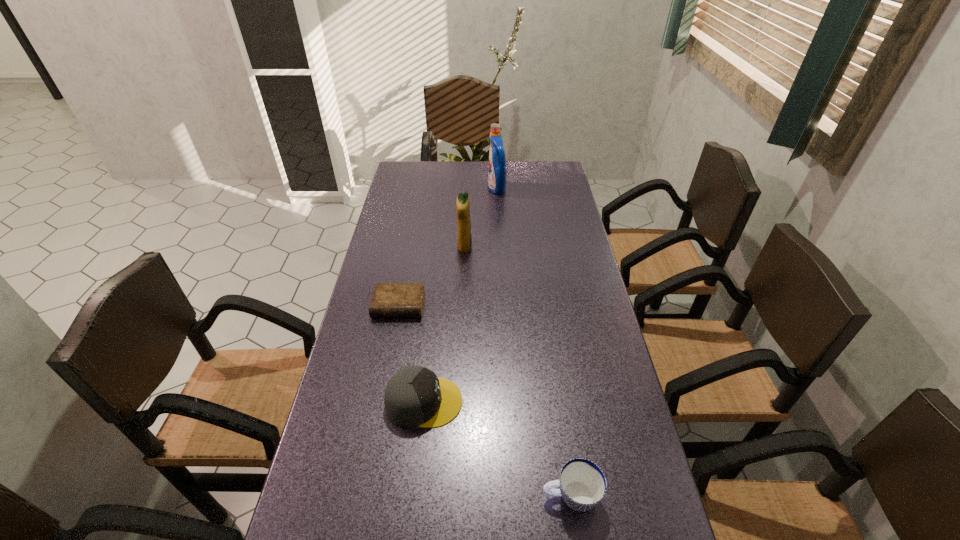
Locate an element on the screen. This screenshot has height=540, width=960. free space between the third nearest object and the left detergent is located at coordinates (432, 276).

Find the location of a particular element. This screenshot has height=540, width=960. free point between the third nearest object and the cap is located at coordinates (412, 354).

Locate an element on the screen. The image size is (960, 540). free area in between the right detergent and the shortest object is located at coordinates (447, 247).

I want to click on free space between the cap and the nearest object, so click(x=497, y=449).

Locate an element on the screen. vacant space in between the left detergent and the cap is located at coordinates (444, 325).

This screenshot has height=540, width=960. Identify the location of free space that is in between the nearer detergent and the rightmost object. (517, 372).

Identify which object is located as the third nearest to the rightmost object. Please provide its 2D coordinates. Your answer should be formatted as a tuple, i.e. [(x, y)], where the tuple contains the x and y coordinates of a point satisfying the conditions above.

[(464, 241)]

At what (x,y) coordinates should I click in order to perform the action: click on object that is the second closest to the fourth farthest object. Please return your answer as a coordinate pair (x, y). This screenshot has height=540, width=960. Looking at the image, I should click on (582, 483).